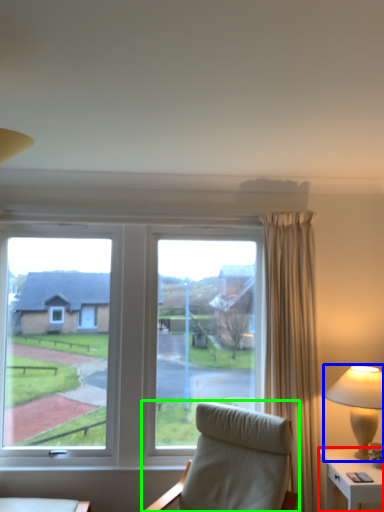
Question: Which is nearer to the nightstand (highlighted by a red box)? lamp (highlighted by a blue box) or chair (highlighted by a green box).

Choices:
 (A) lamp
 (B) chair

Answer: (A)